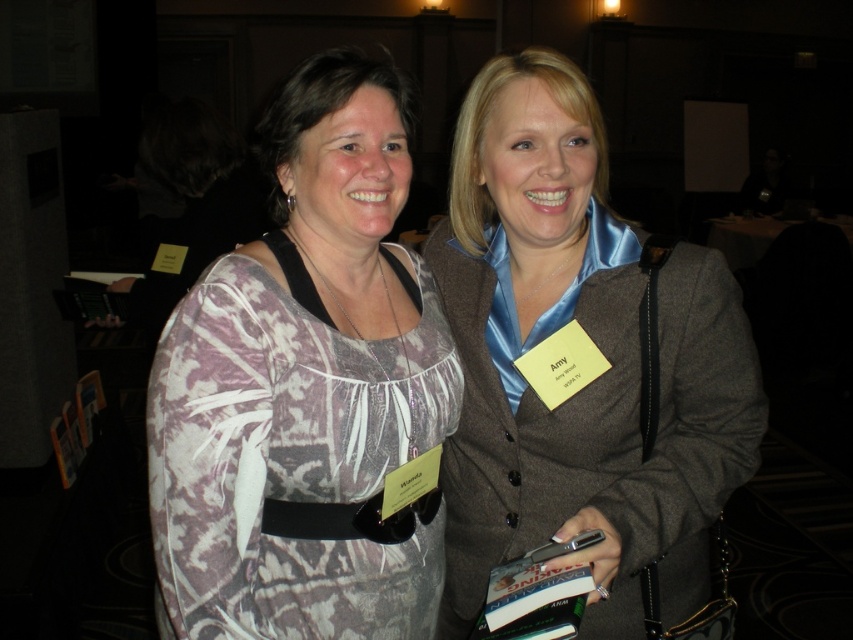
Based on the photo, which is below, printed fabric dress at center or satin blue blouse at center?

Positioned lower is satin blue blouse at center.

Does point (367, 323) come behind point (537, 200)?

Yes, it is behind point (537, 200).

The width and height of the screenshot is (853, 640). I want to click on printed fabric dress at center, so click(x=305, y=388).